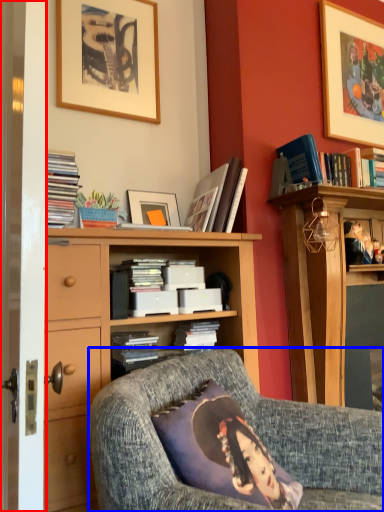
Question: Among these objects, which one is farthest to the camera, screen door (highlighted by a red box) or chair (highlighted by a blue box)?

Choices:
 (A) screen door
 (B) chair

Answer: (A)